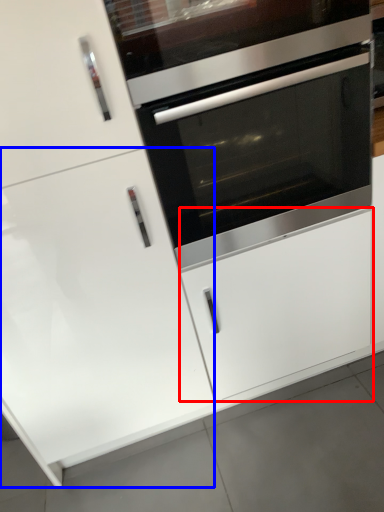
Question: Which point is closer to the camera, drawer (highlighted by a red box) or door (highlighted by a blue box)?

Choices:
 (A) drawer
 (B) door

Answer: (B)